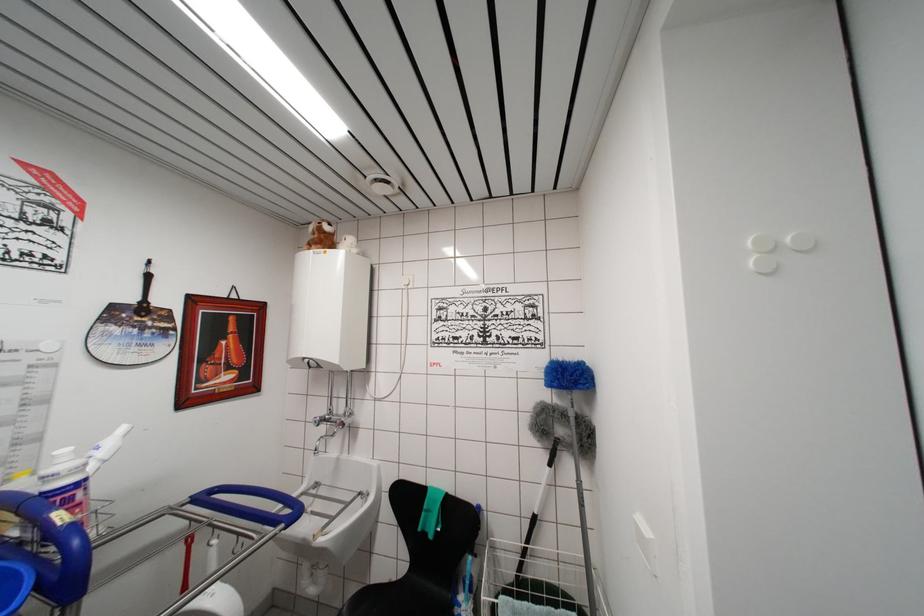
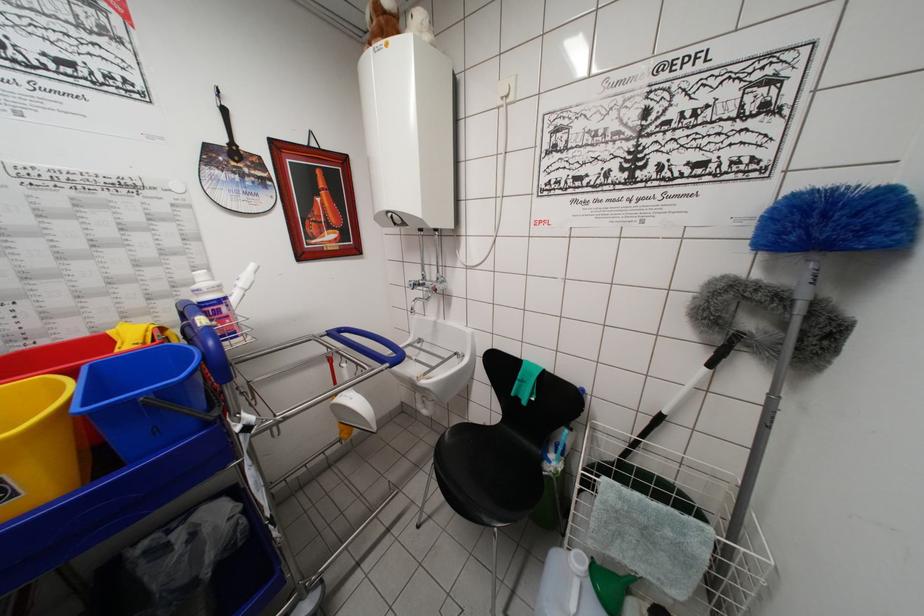
Locate, in the second image, the point that corresponds to [317,541] in the first image.

(420, 383)